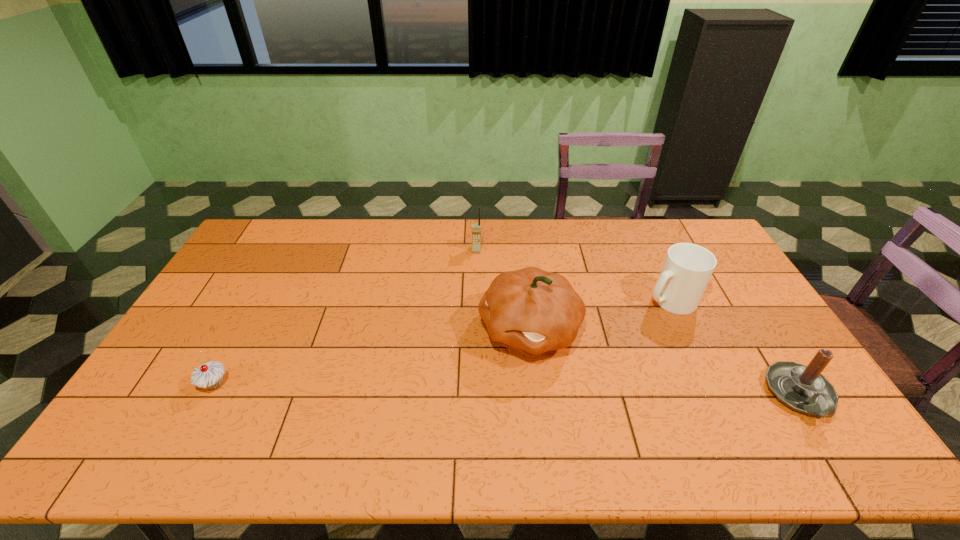
At what (x,y) coordinates should I click in order to perform the action: click on vacant area at the near right corner of the desktop. Please return your answer as a coordinate pair (x, y). Image resolution: width=960 pixels, height=540 pixels. Looking at the image, I should click on (816, 416).

This screenshot has width=960, height=540. What are the coordinates of `unoccupied position between the leftmost object and the farthest object` in the screenshot? It's located at (346, 318).

At what (x,y) coordinates should I click in order to perform the action: click on unoccupied position between the tallest object and the rightmost object. Please return your answer as a coordinate pair (x, y). This screenshot has height=540, width=960. Looking at the image, I should click on (664, 362).

I want to click on empty space between the farthest object and the candle, so click(638, 322).

Where is `vacant point located between the rightmost object and the cellular telephone`? The width and height of the screenshot is (960, 540). vacant point located between the rightmost object and the cellular telephone is located at coordinates (638, 322).

Identify the location of unoccupied area between the second object from right to left and the tallest object. (600, 314).

You are a GUI agent. You are given a task and a screenshot of the screen. Output one action in this format:
    pyautogui.click(x=<x>, y=<y>)
    Task: Click on the free point between the mug and the cellular telephone
    The image size is (960, 540).
    Given the screenshot: What is the action you would take?
    pyautogui.click(x=573, y=275)

Where is `free space between the rightmost object and the farthest object`? This screenshot has width=960, height=540. free space between the rightmost object and the farthest object is located at coordinates (x=638, y=322).

Locate an element on the screen. The height and width of the screenshot is (540, 960). free spot between the leftmost object and the candle is located at coordinates (507, 389).

Locate an element on the screen. vacant space that is in between the mug and the farthest object is located at coordinates (573, 275).